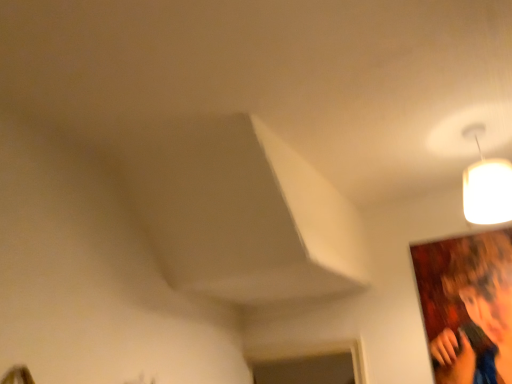
Describe the element at coordinates (478, 310) in the screenshot. I see `smooth brown hair at upper right` at that location.

Where is `smooth brown hair at upper right`? smooth brown hair at upper right is located at coordinates (478, 310).

I want to click on white matte lampshade at upper right, so click(486, 185).

This screenshot has width=512, height=384. Describe the element at coordinates (486, 185) in the screenshot. I see `white matte lampshade at upper right` at that location.

You are a GUI agent. You are given a task and a screenshot of the screen. Output one action in this format:
    pyautogui.click(x=<x>, y=<y>)
    Task: Click on the smooth brown hair at upper right
    The image size is (512, 384).
    Given the screenshot: What is the action you would take?
    pyautogui.click(x=478, y=310)

Between white matte lampshade at upper right and smooth brown hair at upper right, which one appears on the left side from the viewer's perspective?

white matte lampshade at upper right is more to the left.

Between white matte lampshade at upper right and smooth brown hair at upper right, which one is positioned behind?

smooth brown hair at upper right is more distant.

Considering the points (490, 159) and (507, 376), which point is in front, point (490, 159) or point (507, 376)?

Positioned in front is point (507, 376).

From the image's perspective, between white matte lampshade at upper right and smooth brown hair at upper right, who is located below?

smooth brown hair at upper right appears lower in the image.

From a real-world perspective, is white matte lampshade at upper right located beneath smooth brown hair at upper right?

No, from a real-world perspective, white matte lampshade at upper right is not beneath smooth brown hair at upper right.

Considering the sizes of objects white matte lampshade at upper right and smooth brown hair at upper right in the image provided, who is wider, white matte lampshade at upper right or smooth brown hair at upper right?

white matte lampshade at upper right.

Can you confirm if white matte lampshade at upper right is shorter than smooth brown hair at upper right?

Indeed, white matte lampshade at upper right has a lesser height compared to smooth brown hair at upper right.

Which of these two, white matte lampshade at upper right or smooth brown hair at upper right, is bigger?

Bigger between the two is white matte lampshade at upper right.

Would you say white matte lampshade at upper right is inside or outside smooth brown hair at upper right?

white matte lampshade at upper right is located beyond the bounds of smooth brown hair at upper right.

Is white matte lampshade at upper right in contact with smooth brown hair at upper right?

No, white matte lampshade at upper right is not in contact with smooth brown hair at upper right.

Could you tell me if white matte lampshade at upper right is turned towards smooth brown hair at upper right?

No, white matte lampshade at upper right is not oriented towards smooth brown hair at upper right.

What's the angular difference between white matte lampshade at upper right and smooth brown hair at upper right's facing directions?

90.4 degrees separate the facing orientations of white matte lampshade at upper right and smooth brown hair at upper right.

You are a GUI agent. You are given a task and a screenshot of the screen. Output one action in this format:
    pyautogui.click(x=<x>, y=<y>)
    Task: Click on the lamp located on the left of smooth brown hair at upper right
    The image size is (512, 384).
    Given the screenshot: What is the action you would take?
    pyautogui.click(x=486, y=185)

Is smooth brown hair at upper right at the right side of white matte lampshade at upper right?

Correct, you'll find smooth brown hair at upper right to the right of white matte lampshade at upper right.

Relative to white matte lampshade at upper right, is smooth brown hair at upper right in front or behind?

Visually, smooth brown hair at upper right is located behind white matte lampshade at upper right.

Between point (486, 306) and point (502, 210), which one is positioned behind?

Positioned behind is point (486, 306).

From the image's perspective, who appears lower, smooth brown hair at upper right or white matte lampshade at upper right?

smooth brown hair at upper right.

Based on the photo, from a real-world perspective, does smooth brown hair at upper right sit lower than white matte lampshade at upper right?

Correct, in the physical world, smooth brown hair at upper right is lower than white matte lampshade at upper right.

Considering the sizes of objects smooth brown hair at upper right and white matte lampshade at upper right in the image provided, who is wider, smooth brown hair at upper right or white matte lampshade at upper right?

white matte lampshade at upper right.

Considering the sizes of objects smooth brown hair at upper right and white matte lampshade at upper right in the image provided, who is taller, smooth brown hair at upper right or white matte lampshade at upper right?

With more height is smooth brown hair at upper right.

Based on their sizes in the image, would you say smooth brown hair at upper right is bigger or smaller than white matte lampshade at upper right?

smooth brown hair at upper right is smaller than white matte lampshade at upper right.

Is white matte lampshade at upper right inside smooth brown hair at upper right?

No, white matte lampshade at upper right is not inside smooth brown hair at upper right.

Are smooth brown hair at upper right and white matte lampshade at upper right making contact?

No, smooth brown hair at upper right is not touching white matte lampshade at upper right.

Is smooth brown hair at upper right looking in the opposite direction of white matte lampshade at upper right?

That's not correct — smooth brown hair at upper right is not looking away from white matte lampshade at upper right.

You are a GUI agent. You are given a task and a screenshot of the screen. Output one action in this format:
    pyautogui.click(x=<x>, y=<y>)
    Task: Click on the person on the right of white matte lampshade at upper right
    
    Given the screenshot: What is the action you would take?
    pyautogui.click(x=478, y=310)

Locate an element on the screen. person beneath the white matte lampshade at upper right (from a real-world perspective) is located at coordinates (478, 310).

What are the coordinates of `lamp above the smooth brown hair at upper right (from the image's perspective)` in the screenshot? It's located at (486, 185).